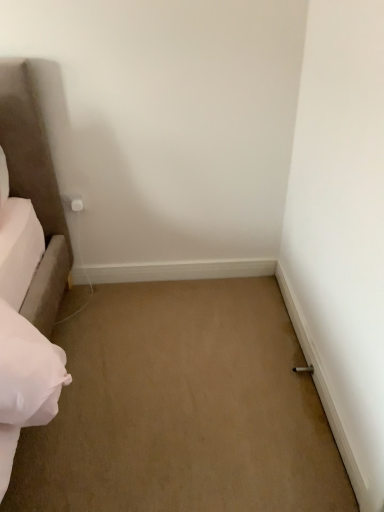
Find the location of a particular element. This screenshot has width=384, height=512. vacant region above beige carpet at center (from a real-world perspective) is located at coordinates (119, 381).